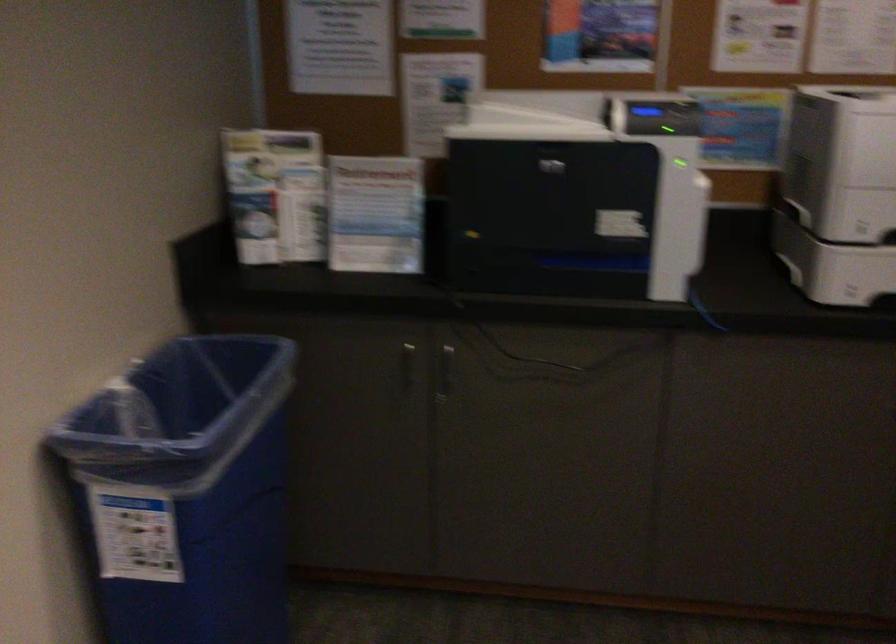
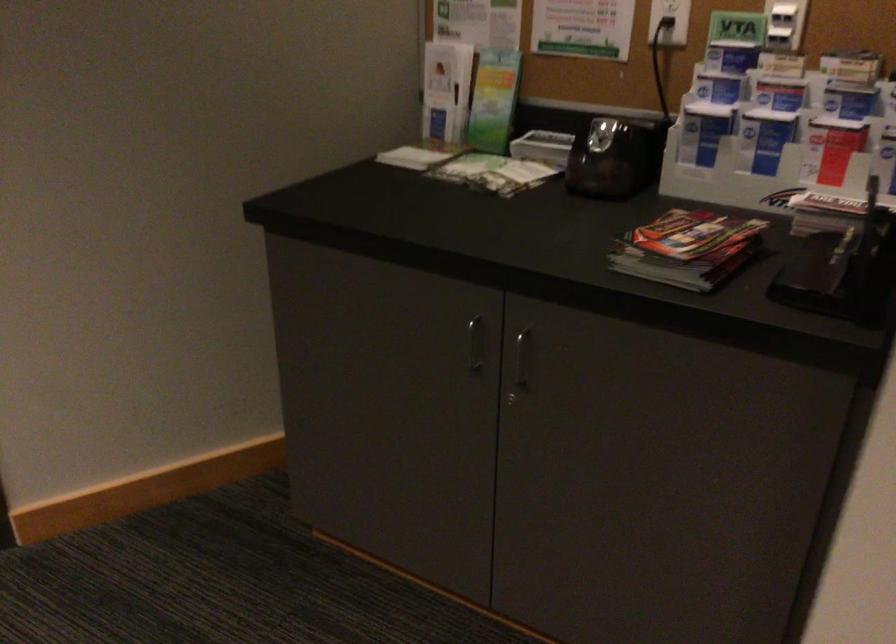
Based on the photo, based on the continuous images, in which direction is the camera rotating?

The camera's rotation is toward left-down.